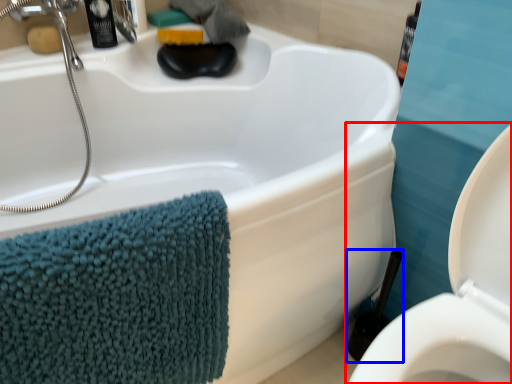
Question: Which object is closer to the camera taking this photo, toilet (highlighted by a red box) or brush (highlighted by a blue box)?

Choices:
 (A) toilet
 (B) brush

Answer: (A)